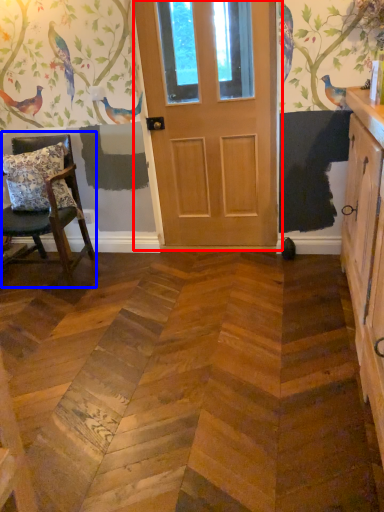
Question: Which object is closer to the camera taking this photo, door (highlighted by a red box) or chair (highlighted by a blue box)?

Choices:
 (A) door
 (B) chair

Answer: (B)